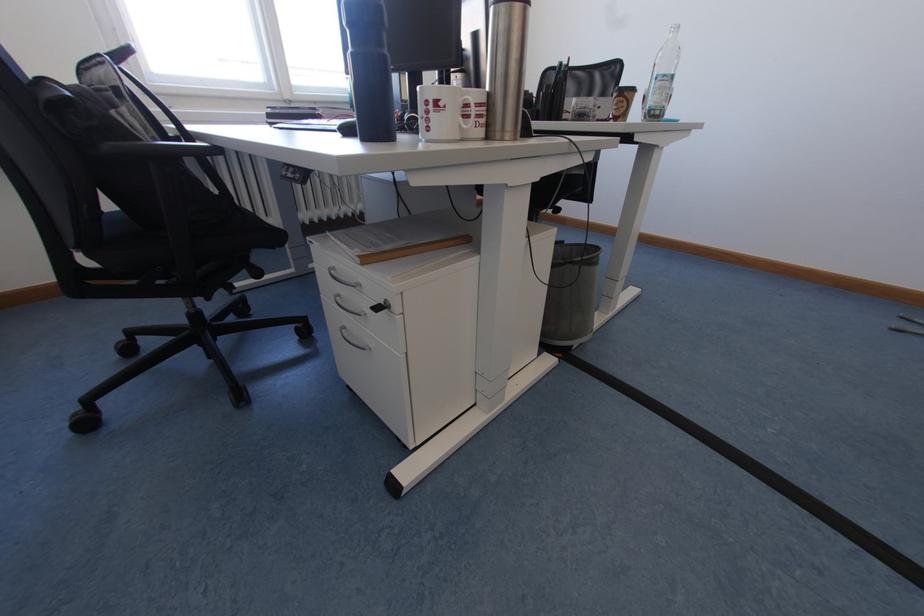
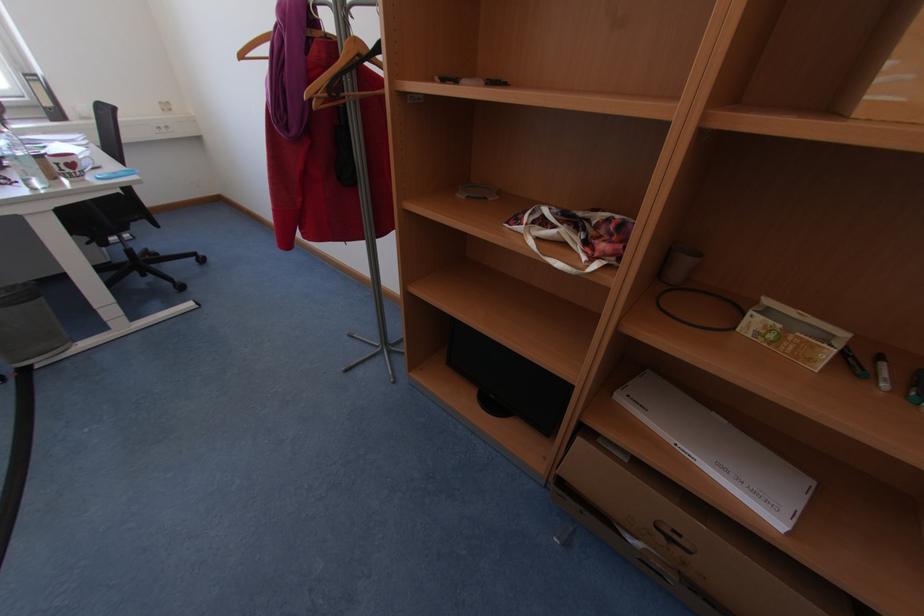
Question: In a continuous first-person perspective shot, in which direction is the camera moving?

Choices:
 (A) Left
 (B) Right
 (C) Forward
 (D) Backward

Answer: (B)